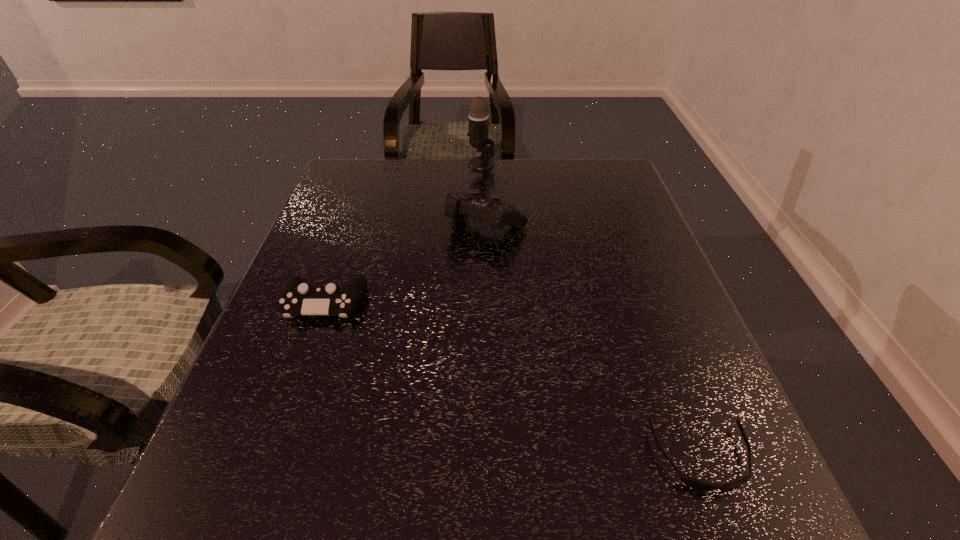
Identify the location of vacant region between the taller control and the rightmost object. (594, 342).

The width and height of the screenshot is (960, 540). Find the location of `vacant area that lies between the farther control and the left control`. vacant area that lies between the farther control and the left control is located at coordinates (406, 265).

At what (x,y) coordinates should I click in order to perform the action: click on object that stands as the closest to the third farthest object. Please return your answer as a coordinate pair (x, y). The width and height of the screenshot is (960, 540). Looking at the image, I should click on (499, 214).

Locate an element on the screen. This screenshot has height=540, width=960. object that is the closest to the farther control is located at coordinates (478, 133).